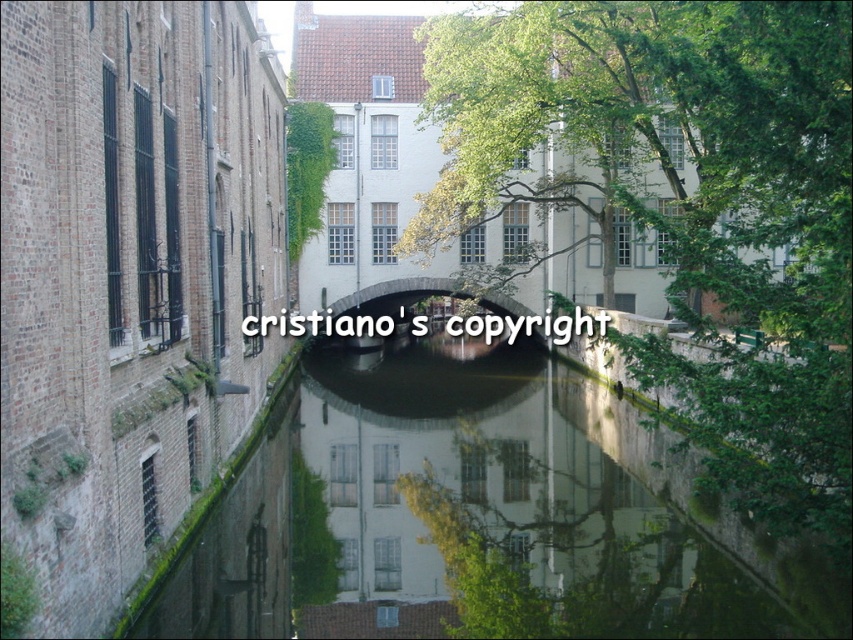
Question: Among these objects, which one is nearest to the camera?

Choices:
 (A) green mossy water at center
 (B) green leafy tree at center
 (C) matte stone bridge at center

Answer: (B)

Question: Is green mossy water at center positioned before matte stone bridge at center?

Choices:
 (A) no
 (B) yes

Answer: (B)

Question: Which point is closer to the camera?

Choices:
 (A) (340, 605)
 (B) (372, 305)

Answer: (A)

Question: Can you confirm if green mossy water at center is thinner than matte stone bridge at center?

Choices:
 (A) no
 (B) yes

Answer: (A)

Question: Can you confirm if green mossy water at center is positioned to the left of matte stone bridge at center?

Choices:
 (A) no
 (B) yes

Answer: (A)

Question: Estimate the real-world distances between objects in this image. Which object is farther from the green mossy water at center?

Choices:
 (A) green leafy tree at center
 (B) matte stone bridge at center

Answer: (B)